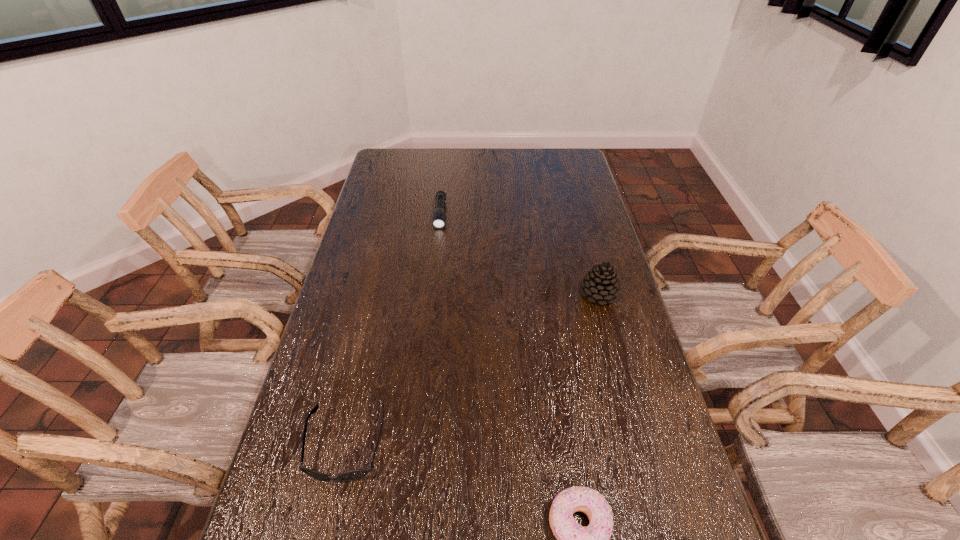
You are a GUI agent. You are given a task and a screenshot of the screen. Output one action in this format:
    pyautogui.click(x=<x>, y=<y>)
    Task: Click on the vacant space in between the third farthest object and the rightmost object
    Image resolution: width=960 pixels, height=540 pixels.
    Given the screenshot: What is the action you would take?
    pyautogui.click(x=472, y=370)

The width and height of the screenshot is (960, 540). Identify the location of free spot between the pinecone and the shortest object. (519, 254).

You are a GUI agent. You are given a task and a screenshot of the screen. Output one action in this format:
    pyautogui.click(x=<x>, y=<y>)
    Task: Click on the free space between the flashlight and the pinecone
    
    Given the screenshot: What is the action you would take?
    pyautogui.click(x=519, y=254)

The width and height of the screenshot is (960, 540). I want to click on vacant area between the flashlight and the rightmost object, so click(x=519, y=254).

You are a GUI agent. You are given a task and a screenshot of the screen. Output one action in this format:
    pyautogui.click(x=<x>, y=<y>)
    Task: Click on the free space between the sunglasses and the flashlight
    Image resolution: width=960 pixels, height=540 pixels.
    Given the screenshot: What is the action you would take?
    pyautogui.click(x=394, y=330)

Image resolution: width=960 pixels, height=540 pixels. I want to click on vacant area between the sunglasses and the third nearest object, so (472, 370).

Find the location of a particular element. Image resolution: width=960 pixels, height=540 pixels. blank region between the flashlight and the leftmost object is located at coordinates (394, 330).

What are the coordinates of `free space between the tallest object and the third farthest object` in the screenshot? It's located at (472, 370).

Choose which object is the third nearest neighbor to the flashlight. Please provide its 2D coordinates. Your answer should be formatted as a tuple, i.e. [(x, y)], where the tuple contains the x and y coordinates of a point satisfying the conditions above.

[(573, 539)]

Where is `object that is the second closest to the third nearest object`? object that is the second closest to the third nearest object is located at coordinates (573, 539).